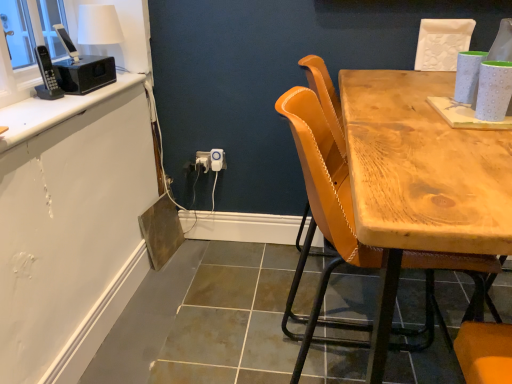
Identify the location of white glossy countertop at upper left. The width and height of the screenshot is (512, 384). (54, 110).

I want to click on white plastic power outlet at center, positioned as the 2th power outlet in left-to-right order, so click(x=217, y=160).

Describe the element at coordinates (217, 160) in the screenshot. The width and height of the screenshot is (512, 384). I see `white plastic power outlet at center, positioned as the 2th power outlet in left-to-right order` at that location.

Locate an element on the screen. white plastic electric outlet at center is located at coordinates (211, 160).

Is white glossy countertop at upper left positioned beyond the bounds of leather-like yellow chair at center?

Yes.

Find the location of a particular element. This screenshot has width=512, height=384. counter top on the left of the leather-like yellow chair at center is located at coordinates (54, 110).

Which object is positioned more to the right, white glossy countertop at upper left or leather-like yellow chair at center?

From the viewer's perspective, leather-like yellow chair at center appears more on the right side.

Is white plastic electric outlet at center not close to leather-like yellow chair at center?

No.

The image size is (512, 384). I want to click on chair located on the right of white plastic electric outlet at center, so click(323, 214).

Is white plastic electric outlet at center facing towards leather-like yellow chair at center?

No.

From the image's perspective, is white plastic electric outlet at center beneath leather-like yellow chair at center?

No, from the image's perspective, white plastic electric outlet at center is not beneath leather-like yellow chair at center.

Considering the positions of objects white plastic power outlet at center, positioned as the 2th power outlet in left-to-right order, and leather-like yellow chair at center in the image provided, who is in front, white plastic power outlet at center, positioned as the 2th power outlet in left-to-right order, or leather-like yellow chair at center?

leather-like yellow chair at center is more forward.

From a real-world perspective, between white plastic power outlet at center, positioned as the 2th power outlet in left-to-right order, and leather-like yellow chair at center, who is vertically higher?

leather-like yellow chair at center is physically above.

Is there a large distance between white plastic power outlet at center, positioned as the 2th power outlet in left-to-right order, and leather-like yellow chair at center?

white plastic power outlet at center, positioned as the 2th power outlet in left-to-right order, is near leather-like yellow chair at center, not far away.

You are a GUI agent. You are given a task and a screenshot of the screen. Output one action in this format:
    pyautogui.click(x=<x>, y=<y>)
    Task: Click on the chair in front of the white plastic power outlet at center, which is the first power outlet in right-to-left order
    The image size is (512, 384).
    Given the screenshot: What is the action you would take?
    pyautogui.click(x=323, y=214)

How different are the orientations of white plastic electric outlet at center and white glossy countertop at upper left in degrees?

They differ by 90.9 degrees in their facing directions.

You are a GUI agent. You are given a task and a screenshot of the screen. Output one action in this format:
    pyautogui.click(x=<x>, y=<y>)
    Task: Click on the electric outlet that appears on the right of white glossy countertop at upper left
    
    Given the screenshot: What is the action you would take?
    pyautogui.click(x=211, y=160)

From a real-world perspective, is white plastic electric outlet at center on top of white glossy countertop at upper left?

No.

Between point (195, 166) and point (75, 97), which one is positioned behind?

Point (195, 166)

Based on the photo, which is correct: white plastic power outlet at center, positioned as the 2th power outlet in left-to-right order, is inside white plastic power outlet at lower center, marked as the 1th power outlet in a left-to-right arrangement, or outside of it?

white plastic power outlet at center, positioned as the 2th power outlet in left-to-right order, cannot be found inside white plastic power outlet at lower center, marked as the 1th power outlet in a left-to-right arrangement.

Considering the relative sizes of white plastic power outlet at center, which is the first power outlet in right-to-left order, and white plastic power outlet at lower center, placed as the 2th power outlet when sorted from right to left, in the image provided, is white plastic power outlet at center, which is the first power outlet in right-to-left order, smaller than white plastic power outlet at lower center, placed as the 2th power outlet when sorted from right to left,?

No.

The height and width of the screenshot is (384, 512). I want to click on power outlet on the left of white plastic power outlet at center, positioned as the 2th power outlet in left-to-right order, so click(203, 161).

Does white plastic power outlet at center, positioned as the 2th power outlet in left-to-right order, touch white plastic power outlet at lower center, placed as the 2th power outlet when sorted from right to left?

Yes, the surface of white plastic power outlet at center, positioned as the 2th power outlet in left-to-right order, is in contact with white plastic power outlet at lower center, placed as the 2th power outlet when sorted from right to left.

Does point (206, 165) come closer to viewer compared to point (211, 160)?

No, it is behind (211, 160).

Is white plastic power outlet at lower center, placed as the 2th power outlet when sorted from right to left, to the left of white plastic power outlet at center, which is the first power outlet in right-to-left order, from the viewer's perspective?

Yes, white plastic power outlet at lower center, placed as the 2th power outlet when sorted from right to left, is to the left of white plastic power outlet at center, which is the first power outlet in right-to-left order.

Can you tell me how much white plastic power outlet at lower center, placed as the 2th power outlet when sorted from right to left, and white plastic power outlet at center, positioned as the 2th power outlet in left-to-right order, differ in facing direction?

The angular difference between white plastic power outlet at lower center, placed as the 2th power outlet when sorted from right to left, and white plastic power outlet at center, positioned as the 2th power outlet in left-to-right order, is 0.295 degrees.

Can we say white plastic power outlet at lower center, marked as the 1th power outlet in a left-to-right arrangement, lies outside white plastic power outlet at center, which is the first power outlet in right-to-left order?

white plastic power outlet at lower center, marked as the 1th power outlet in a left-to-right arrangement, lies outside white plastic power outlet at center, which is the first power outlet in right-to-left order,'s area.

In terms of width, does white plastic power outlet at lower center, marked as the 1th power outlet in a left-to-right arrangement, look wider or thinner when compared to leather-like yellow chair at center?

In the image, white plastic power outlet at lower center, marked as the 1th power outlet in a left-to-right arrangement, appears to be more narrow than leather-like yellow chair at center.

Would you say white plastic power outlet at lower center, marked as the 1th power outlet in a left-to-right arrangement, is inside or outside leather-like yellow chair at center?

white plastic power outlet at lower center, marked as the 1th power outlet in a left-to-right arrangement, is not enclosed by leather-like yellow chair at center.

Based on their sizes in the image, would you say white plastic power outlet at lower center, marked as the 1th power outlet in a left-to-right arrangement, is bigger or smaller than leather-like yellow chair at center?

Considering their sizes, white plastic power outlet at lower center, marked as the 1th power outlet in a left-to-right arrangement, takes up less space than leather-like yellow chair at center.

Based on the photo, is white plastic power outlet at lower center, placed as the 2th power outlet when sorted from right to left, positioned with its back to leather-like yellow chair at center?

No, leather-like yellow chair at center is not at the back of white plastic power outlet at lower center, placed as the 2th power outlet when sorted from right to left.

I want to click on counter top on the left side of leather-like yellow chair at center, so click(x=54, y=110).

I want to click on electric outlet below the leather-like yellow chair at center (from a real-world perspective), so click(x=211, y=160).

Which object lies nearer to the anchor point leather-like yellow chair at center, white glossy countertop at upper left or white plastic electric outlet at center?

Based on the image, white plastic electric outlet at center appears to be nearer to leather-like yellow chair at center.

From the picture: When comparing their distances from white plastic power outlet at center, positioned as the 2th power outlet in left-to-right order, does leather-like yellow chair at center or white plastic power outlet at lower center, placed as the 2th power outlet when sorted from right to left, seem further?

leather-like yellow chair at center lies further to white plastic power outlet at center, positioned as the 2th power outlet in left-to-right order, than the other object.

When comparing their distances from white plastic power outlet at lower center, marked as the 1th power outlet in a left-to-right arrangement, does leather-like yellow chair at center or white plastic electric outlet at center seem further?

The object further to white plastic power outlet at lower center, marked as the 1th power outlet in a left-to-right arrangement, is leather-like yellow chair at center.

Based on their spatial positions, is white plastic electric outlet at center or leather-like yellow chair at center closer to white plastic power outlet at center, which is the first power outlet in right-to-left order?

Based on the image, white plastic electric outlet at center appears to be nearer to white plastic power outlet at center, which is the first power outlet in right-to-left order.

Based on their spatial positions, is white plastic power outlet at lower center, marked as the 1th power outlet in a left-to-right arrangement, or white glossy countertop at upper left further from white plastic power outlet at center, which is the first power outlet in right-to-left order?

The object further to white plastic power outlet at center, which is the first power outlet in right-to-left order, is white glossy countertop at upper left.

When comparing their distances from white plastic electric outlet at center, does white plastic power outlet at center, which is the first power outlet in right-to-left order, or leather-like yellow chair at center seem further?

The object further to white plastic electric outlet at center is leather-like yellow chair at center.

Looking at this image, when comparing their distances from white glossy countertop at upper left, does leather-like yellow chair at center or white plastic power outlet at lower center, placed as the 2th power outlet when sorted from right to left, seem closer?

white plastic power outlet at lower center, placed as the 2th power outlet when sorted from right to left.

Estimate the real-world distances between objects in this image. Which object is closer to leather-like yellow chair at center, white plastic electric outlet at center or white plastic power outlet at lower center, marked as the 1th power outlet in a left-to-right arrangement?

white plastic electric outlet at center is closer to leather-like yellow chair at center.

The height and width of the screenshot is (384, 512). I want to click on counter top located between leather-like yellow chair at center and white plastic electric outlet at center in the depth direction, so click(54, 110).

Where is `power outlet between white glossy countertop at upper left and white plastic power outlet at lower center, marked as the 1th power outlet in a left-to-right arrangement, along the z-axis`? power outlet between white glossy countertop at upper left and white plastic power outlet at lower center, marked as the 1th power outlet in a left-to-right arrangement, along the z-axis is located at coordinates (217, 160).

This screenshot has width=512, height=384. I want to click on counter top positioned between leather-like yellow chair at center and white plastic power outlet at lower center, placed as the 2th power outlet when sorted from right to left, from near to far, so click(x=54, y=110).

You are a GUI agent. You are given a task and a screenshot of the screen. Output one action in this format:
    pyautogui.click(x=<x>, y=<y>)
    Task: Click on the electric outlet located between white plastic power outlet at lower center, placed as the 2th power outlet when sorted from right to left, and white plastic power outlet at center, which is the first power outlet in right-to-left order, in the left-right direction
    The width and height of the screenshot is (512, 384).
    Given the screenshot: What is the action you would take?
    pyautogui.click(x=211, y=160)